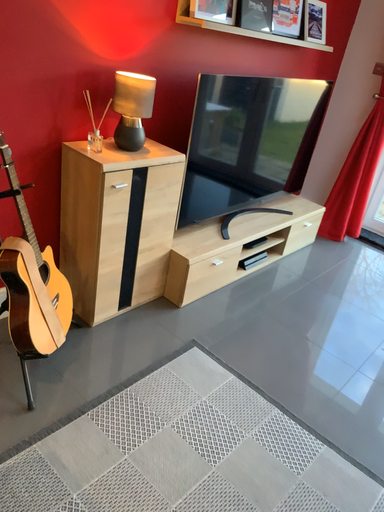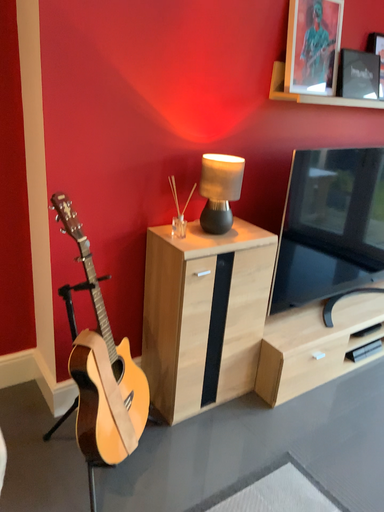
Question: Which way did the camera rotate in the video?

Choices:
 (A) rotated right
 (B) rotated left

Answer: (B)